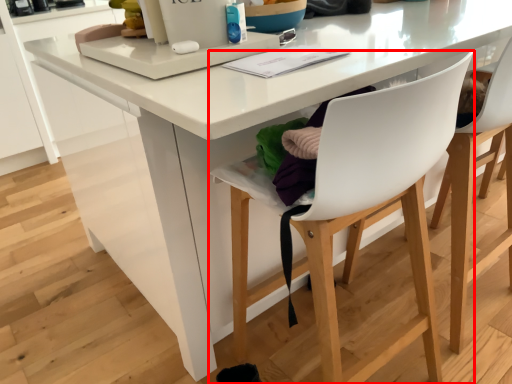
Question: From the image's perspective, what is the correct spatial positioning of chair (annotated by the red box) in reference to chair?

Choices:
 (A) above
 (B) below

Answer: (B)